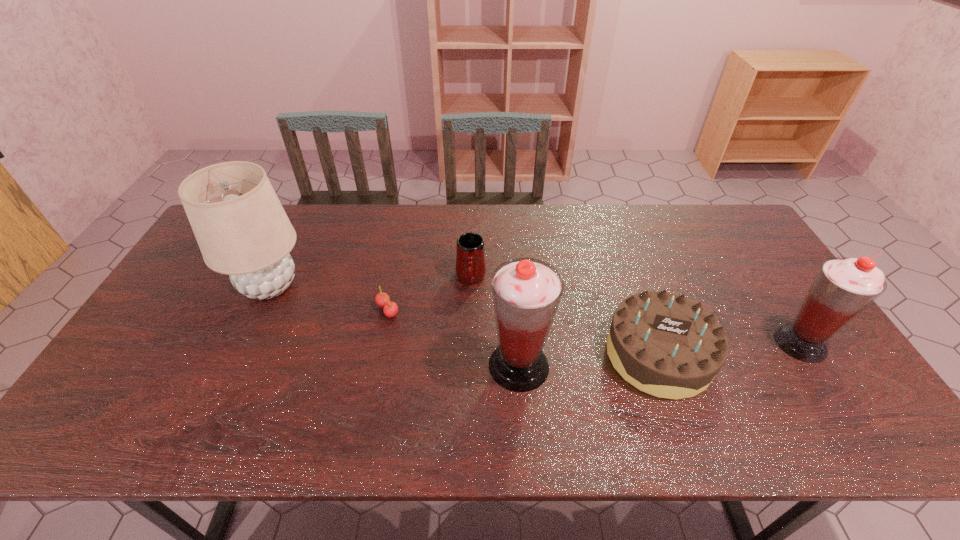
This screenshot has width=960, height=540. What are the coordinates of `vacant area situated 0.370m on the back of the right smoothie` in the screenshot? It's located at (733, 240).

Find the location of a particular element. This screenshot has width=960, height=540. free space located 0.150m on the front of the lampshade is located at coordinates (234, 361).

At what (x,y) coordinates should I click in order to perform the action: click on vacant space located on the left of the cherry. Please return your answer as a coordinate pair (x, y). The width and height of the screenshot is (960, 540). Looking at the image, I should click on (333, 310).

Find the location of a particular element. This screenshot has height=540, width=960. free region located on the side of the third object from left to right with the handle is located at coordinates (469, 357).

Find the location of `smoothie that is at the near edge`. smoothie that is at the near edge is located at coordinates (526, 292).

This screenshot has width=960, height=540. Find the location of `birthday cake at the near edge`. birthday cake at the near edge is located at coordinates (666, 345).

Identify the location of object at the left edge. (242, 230).

Where is `object situated at the right edge`? object situated at the right edge is located at coordinates (843, 287).

Identify the location of free space at the far edge of the desktop. pos(415,244).

The image size is (960, 540). I want to click on vacant area at the near edge, so click(455, 376).